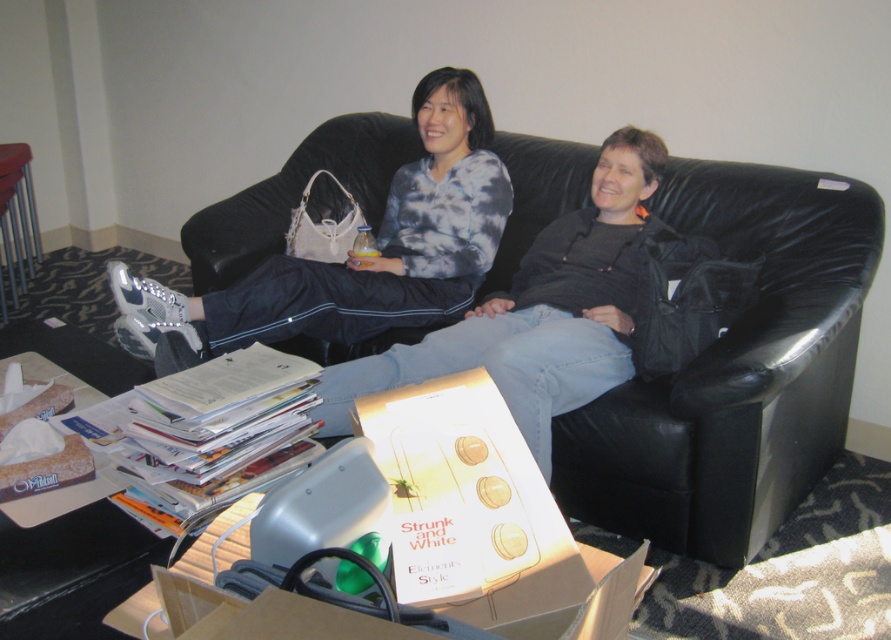
Does black leather couch at center have a lesser height compared to matte gray sweatpants at center?

No, black leather couch at center is not shorter than matte gray sweatpants at center.

Find the location of `black leather couch at center`. black leather couch at center is located at coordinates (734, 371).

Can you confirm if black leather couch at center is wider than cardboard box at lower center?

Correct, the width of black leather couch at center exceeds that of cardboard box at lower center.

Consider the image. Between black leather couch at center and cardboard box at lower center, which one appears on the right side from the viewer's perspective?

From the viewer's perspective, black leather couch at center appears more on the right side.

Between point (610, 506) and point (485, 544), which one is positioned behind?

The point (610, 506) is behind.

At what (x,y) coordinates should I click in order to perform the action: click on black leather couch at center. Please return your answer as a coordinate pair (x, y). Looking at the image, I should click on (734, 371).

Does matte gray sweatpants at center lie in front of cardboard box at lower center?

No, it is behind cardboard box at lower center.

Does matte gray sweatpants at center have a lesser height compared to cardboard box at lower center?

No.

I want to click on matte gray sweatpants at center, so click(375, 248).

Locate an element on the screen. The image size is (891, 640). matte gray sweatpants at center is located at coordinates (375, 248).